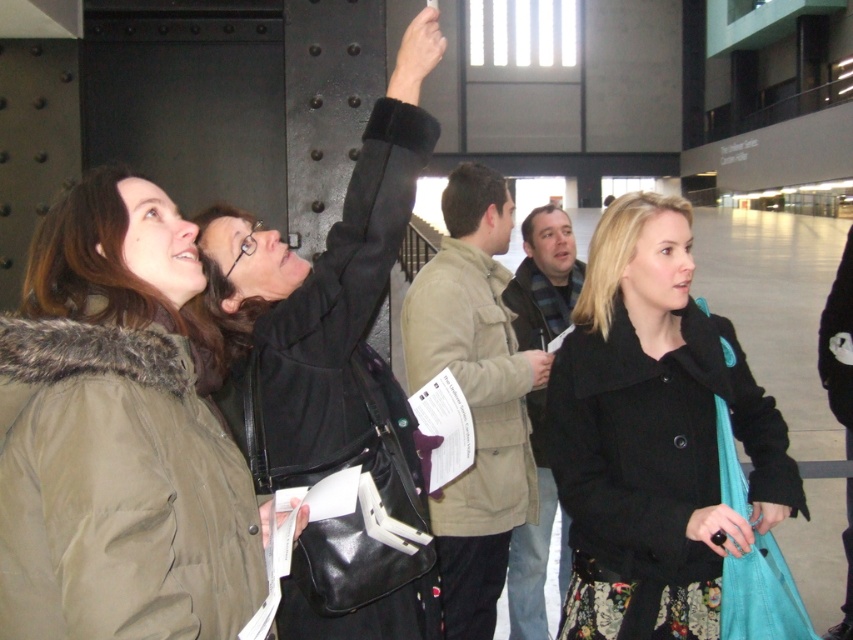
Question: Considering the real-world distances, which object is closest to the matte black jacket at upper center?

Choices:
 (A) black matte coat at center
 (B) khaki fur-trimmed coat at upper left

Answer: (B)

Question: Is black matte coat at center below matte black jacket at upper center?

Choices:
 (A) yes
 (B) no

Answer: (A)

Question: Does khaki fur-trimmed coat at upper left appear over black matte coat at center?

Choices:
 (A) no
 (B) yes

Answer: (B)

Question: Which point is farther to the camera?

Choices:
 (A) (322, 458)
 (B) (238, 476)
 (C) (646, 209)

Answer: (C)

Question: Considering the relative positions of khaki fur-trimmed coat at upper left and black matte coat at center in the image provided, where is khaki fur-trimmed coat at upper left located with respect to black matte coat at center?

Choices:
 (A) above
 (B) below

Answer: (A)

Question: Which point is closer to the camera?

Choices:
 (A) black matte coat at center
 (B) khaki fur-trimmed coat at upper left
 (C) matte black jacket at upper center

Answer: (B)